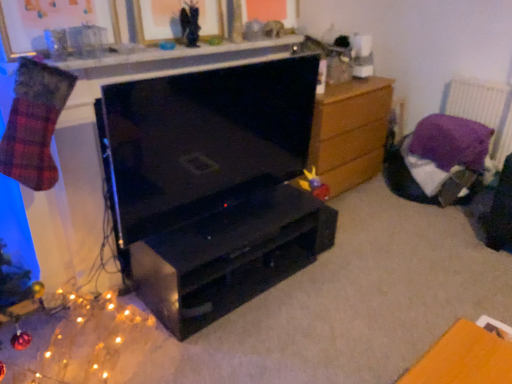
You are a GUI agent. You are given a task and a screenshot of the screen. Output one action in this format:
    pyautogui.click(x=<x>, y=<y>)
    Task: Click on the vacant space underneath black glossy tv at center (from a real-world perspective)
    The width and height of the screenshot is (512, 384).
    Given the screenshot: What is the action you would take?
    pyautogui.click(x=221, y=212)